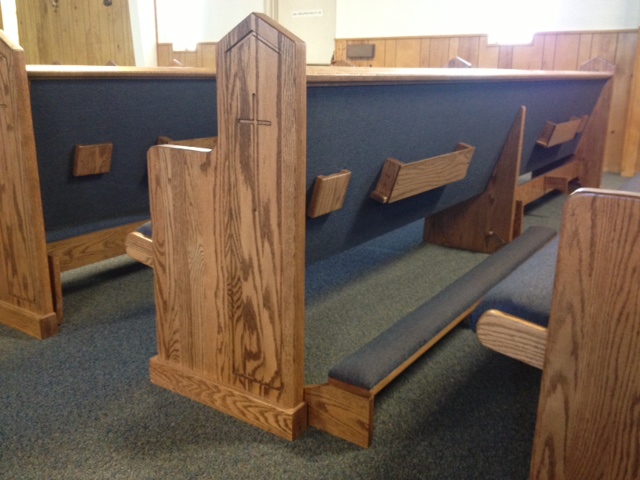
In order to click on top panel border in this screenshot , I will do `click(433, 36)`, `click(612, 31)`.